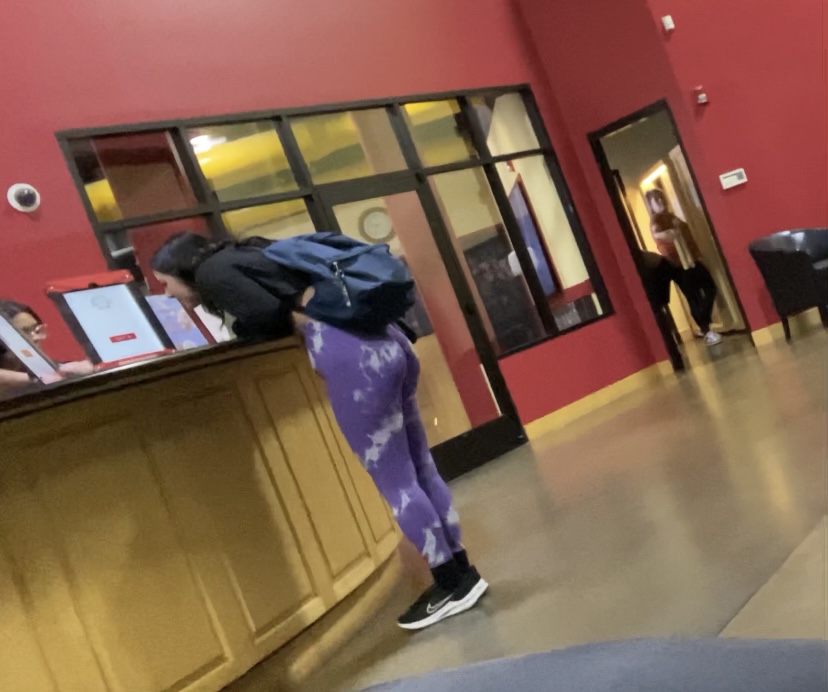
I want to click on bottom of desk, so click(x=128, y=554).